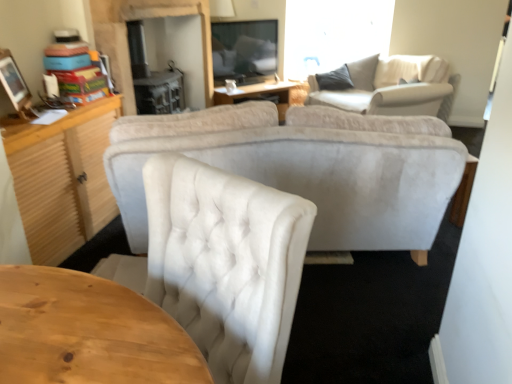
Find the location of `light gray fabric couch at upper right`. light gray fabric couch at upper right is located at coordinates (389, 86).

Measure the distance between white tufted fabric chair at center and camera.

83.10 centimeters.

The height and width of the screenshot is (384, 512). I want to click on wooden table at center, so [258, 95].

What is the approximate height of wooden table at center?

It is 19.07 inches.

You are a GUI agent. You are given a task and a screenshot of the screen. Output one action in this format:
    pyautogui.click(x=<x>, y=<y>)
    Task: Click on the light gray fabric couch at upper right
    Image resolution: width=512 pixels, height=384 pixels.
    Given the screenshot: What is the action you would take?
    pyautogui.click(x=389, y=86)

From the image's perspective, who appears lower, wooden table at center or light gray fabric couch at upper right?

wooden table at center, from the image's perspective.

In the scene shown: Is wooden table at center not inside light gray fabric couch at upper right?

wooden table at center lies outside light gray fabric couch at upper right's area.

Is wooden table at center in front of or behind light gray fabric couch at upper right in the image?

Visually, wooden table at center is located behind light gray fabric couch at upper right.

Locate an element on the screen. Image resolution: width=512 pixels, height=384 pixels. table lying below the light gray fabric couch at upper right (from the image's perspective) is located at coordinates (258, 95).

Visually, is light gray fabric couch at upper right positioned to the left or to the right of wooden table at center?

light gray fabric couch at upper right is to the right of wooden table at center.

Is light gray fabric couch at upper right not within wooden table at center?

Indeed, light gray fabric couch at upper right is completely outside wooden table at center.

From a real-world perspective, is light gray fabric couch at upper right over wooden table at center?

Yes, from a real-world perspective, light gray fabric couch at upper right is over wooden table at center

From a real-world perspective, which is physically below, wooden table at center or white tufted fabric chair at center?

wooden table at center is physically lower.

Is wooden table at center inside or outside of white tufted fabric chair at center?

wooden table at center is located beyond the bounds of white tufted fabric chair at center.

What are the coordinates of `table lying above the white tufted fabric chair at center (from the image's perspective)` in the screenshot? It's located at (258, 95).

Are wooden table at center and white tufted fabric chair at center located far from each other?

Yes, wooden table at center and white tufted fabric chair at center are located far from each other.

Does point (147, 263) come farther from viewer compared to point (275, 91)?

No, (147, 263) is closer to viewer.

How distant is white tufted fabric chair at center from wooden table at center?

white tufted fabric chair at center and wooden table at center are 3.51 meters apart from each other.

Is white tufted fabric chair at center to the left of wooden table at center from the viewer's perspective?

Indeed, white tufted fabric chair at center is positioned on the left side of wooden table at center.

Is white tufted fabric chair at center outside of wooden table at center?

Yes, white tufted fabric chair at center is located beyond the bounds of wooden table at center.

Considering the positions of points (316, 211) and (430, 70), is point (316, 211) closer to camera compared to point (430, 70)?

Yes, it is in front of point (430, 70).

This screenshot has width=512, height=384. Identify the location of chair that appears in front of the light gray fabric couch at upper right. (221, 263).

Considering the sizes of white tufted fabric chair at center and light gray fabric couch at upper right in the image, is white tufted fabric chair at center taller or shorter than light gray fabric couch at upper right?

Considering their sizes, white tufted fabric chair at center has more height than light gray fabric couch at upper right.

Considering the positions of objects white tufted fabric chair at center and light gray fabric couch at upper right in the image provided, who is behind, white tufted fabric chair at center or light gray fabric couch at upper right?

light gray fabric couch at upper right is more distant.

Is light gray fabric couch at upper right far away from white tufted fabric chair at center?

Yes, light gray fabric couch at upper right and white tufted fabric chair at center are located far from each other.

Is white tufted fabric chair at center at the back of light gray fabric couch at upper right?

No, light gray fabric couch at upper right is not facing away from white tufted fabric chair at center.

From the image's perspective, is light gray fabric couch at upper right under white tufted fabric chair at center?

No, from the image's perspective, light gray fabric couch at upper right is not beneath white tufted fabric chair at center.

Identify the location of couch above the wooden table at center (from a real-world perspective). (389, 86).

Locate an element on the screen. The width and height of the screenshot is (512, 384). couch located on the right of wooden table at center is located at coordinates (389, 86).

Considering their positions, is light gray fabric couch at upper right positioned further to white tufted fabric chair at center than wooden table at center?

Among the two, wooden table at center is located further to white tufted fabric chair at center.

From the picture: Based on their spatial positions, is wooden table at center or white tufted fabric chair at center further from light gray fabric couch at upper right?

white tufted fabric chair at center is positioned further to the anchor light gray fabric couch at upper right.

Looking at the image, which one is located closer to wooden table at center, light gray fabric couch at upper right or white tufted fabric chair at center?

light gray fabric couch at upper right.

Consider the image. Considering their positions, is white tufted fabric chair at center positioned further to wooden table at center than light gray fabric couch at upper right?

The object further to wooden table at center is white tufted fabric chair at center.

Which object lies further to the anchor point light gray fabric couch at upper right, white tufted fabric chair at center or wooden table at center?

white tufted fabric chair at center lies further to light gray fabric couch at upper right than the other object.

Considering their positions, is wooden table at center positioned closer to white tufted fabric chair at center than light gray fabric couch at upper right?

light gray fabric couch at upper right is positioned closer to the anchor white tufted fabric chair at center.

Find the location of a particular element. This screenshot has width=512, height=384. couch between white tufted fabric chair at center and wooden table at center in the front-back direction is located at coordinates (389, 86).